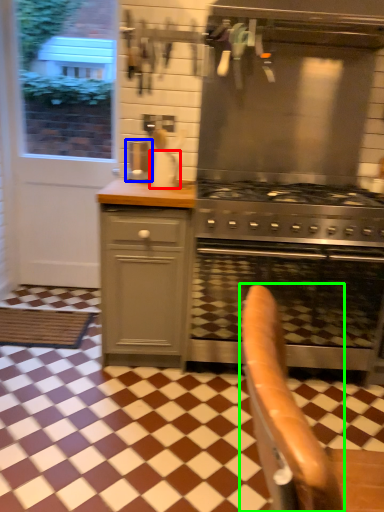
Question: Which object is the closest to the kitchen appliance (highlighted by a red box)? Choose among these: coffee machine (highlighted by a blue box) or armchair (highlighted by a green box).

Choices:
 (A) coffee machine
 (B) armchair

Answer: (A)